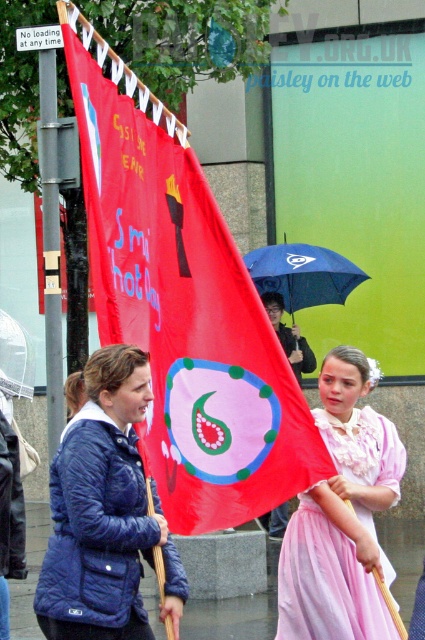
You are a photographer trying to capture a clear photo of both the navy quilted jacket at center and the pink satin dress at center. However, you notice that one is blocking the view of the other. Which object is blocking the other?

The navy quilted jacket at center is blocking the view of the pink satin dress at center because it is positioned in front of it.